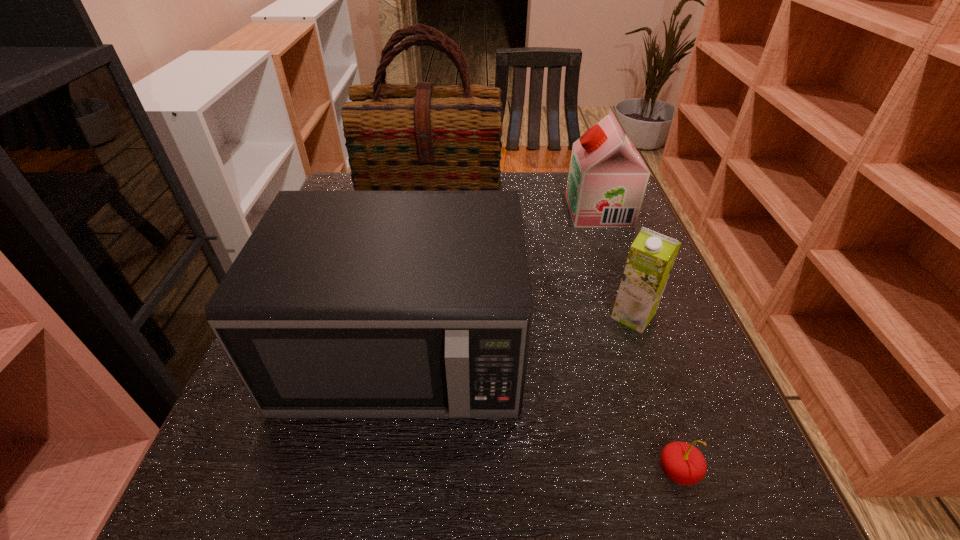
I want to click on vacant region between the shortest object and the shopping bag, so click(x=556, y=338).

Where is `free space between the nearer soya milk and the farther soya milk`? This screenshot has height=540, width=960. free space between the nearer soya milk and the farther soya milk is located at coordinates (616, 264).

Find the location of `object that is the closest to the microwave oven`. object that is the closest to the microwave oven is located at coordinates (398, 137).

The width and height of the screenshot is (960, 540). What are the coordinates of `object that is the nearest to the shopping bag` in the screenshot? It's located at (607, 179).

This screenshot has height=540, width=960. What are the coordinates of `free spot that satisfies the following two spatial constraints: 1. with the cap open on the farther soya milk; 2. on the front side of the nearer soya milk` in the screenshot? It's located at tap(636, 316).

You are a GUI agent. You are given a task and a screenshot of the screen. Output one action in this format:
    pyautogui.click(x=<x>, y=<y>)
    Task: Click on the free region that satisfies the following two spatial constraints: 1. with the cap open on the farther soya milk; 2. on the front side of the second shortest object
    
    Given the screenshot: What is the action you would take?
    636,316

Where is `vacant position in the image that satisfies the following two spatial constraints: 1. on the open handle side of the tallest object; 2. on the left side of the shortest object`? Image resolution: width=960 pixels, height=540 pixels. vacant position in the image that satisfies the following two spatial constraints: 1. on the open handle side of the tallest object; 2. on the left side of the shortest object is located at coordinates (396, 471).